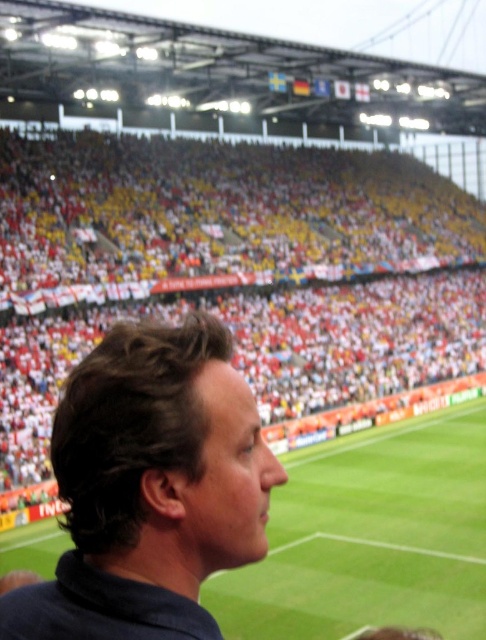
Question: Which point is farther to the camera?

Choices:
 (A) dark brown hair at center
 (B) yellow fabric crowd at upper left

Answer: (B)

Question: Which object appears closest to the camera in this image?

Choices:
 (A) yellow fabric crowd at upper left
 (B) dark brown hair at center

Answer: (B)

Question: Which point appears closest to the camera in this image?

Choices:
 (A) (158, 442)
 (B) (6, 438)

Answer: (A)

Question: Is yellow fabric crowd at upper left above dark brown hair at center?

Choices:
 (A) no
 (B) yes

Answer: (B)

Question: Does yellow fabric crowd at upper left appear on the left side of dark brown hair at center?

Choices:
 (A) yes
 (B) no

Answer: (B)

Question: Is yellow fabric crowd at upper left above dark brown hair at center?

Choices:
 (A) yes
 (B) no

Answer: (A)